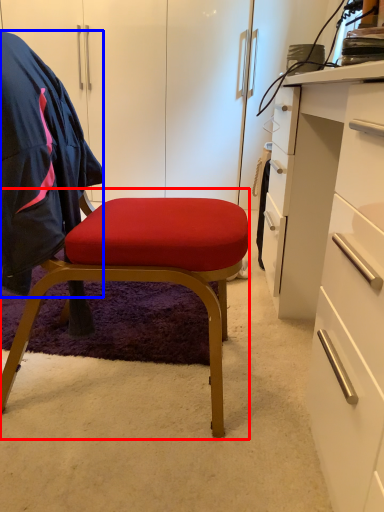
Question: Which object is closer to the camera taking this photo, chair (highlighted by a red box) or clothing (highlighted by a blue box)?

Choices:
 (A) chair
 (B) clothing

Answer: (A)